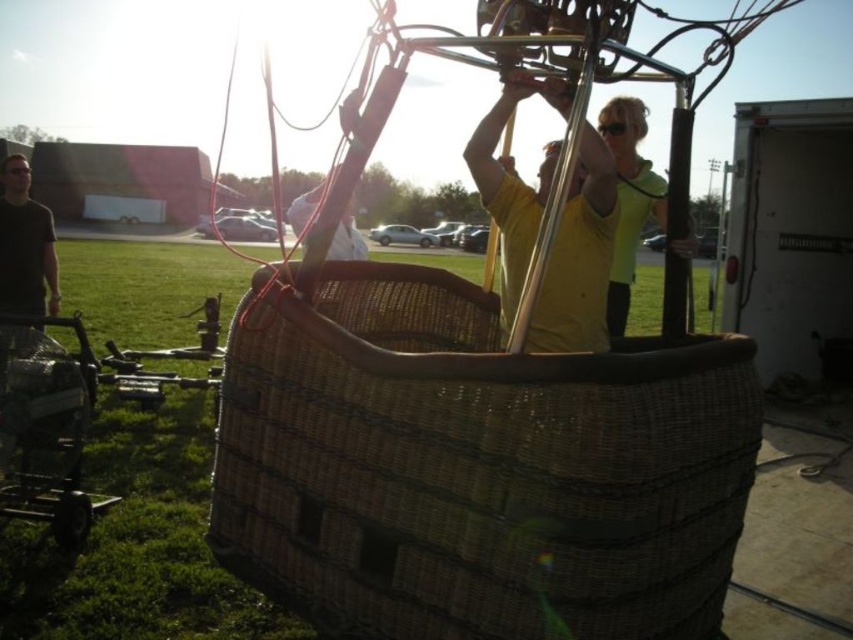
Based on the photo, does yellow matte shirt at center appear over yellow-green fabric at upper center?

No.

Find the location of a particular element. The width and height of the screenshot is (853, 640). yellow matte shirt at center is located at coordinates (578, 259).

Can you confirm if yellow-green fabric at upper center is smaller than matte black shirt at left?

No.

Is point (614, 276) positioned after point (36, 269)?

That is False.

Describe the element at coordinates (628, 198) in the screenshot. The width and height of the screenshot is (853, 640). I see `yellow-green fabric at upper center` at that location.

Locate an element on the screen. Image resolution: width=853 pixels, height=640 pixels. yellow-green fabric at upper center is located at coordinates (628, 198).

Which is more to the left, woven brown basket at center or yellow-green fabric at upper center?

woven brown basket at center is more to the left.

Measure the distance from woven brown basket at center to yellow-green fabric at upper center.

A distance of 3.39 feet exists between woven brown basket at center and yellow-green fabric at upper center.

Find the location of a particular element. The image size is (853, 640). woven brown basket at center is located at coordinates (476, 468).